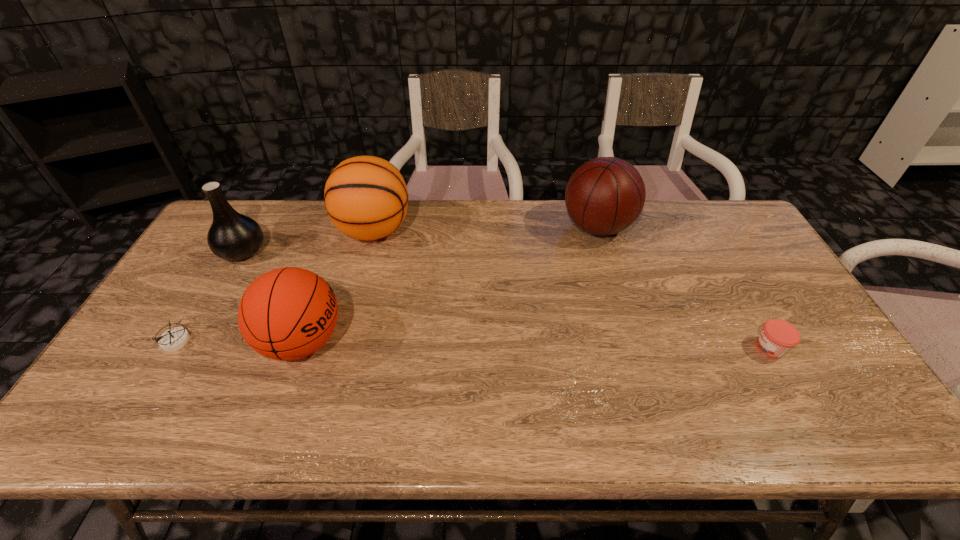
The width and height of the screenshot is (960, 540). Find the location of `vacant space at the left edge of the desktop`. vacant space at the left edge of the desktop is located at coordinates (204, 255).

Where is `free space at the right edge`? The image size is (960, 540). free space at the right edge is located at coordinates (832, 366).

The height and width of the screenshot is (540, 960). Find the location of `vacant space at the near right corner of the desktop`. vacant space at the near right corner of the desktop is located at coordinates (799, 408).

At what (x,y) coordinates should I click in order to perform the action: click on free space between the nearest basketball and the second shortest object. Please return your answer as a coordinate pair (x, y). Image resolution: width=960 pixels, height=540 pixels. Looking at the image, I should click on (537, 345).

Find the location of a particular element. The height and width of the screenshot is (540, 960). free space between the jam and the vase is located at coordinates (506, 299).

Image resolution: width=960 pixels, height=540 pixels. I want to click on vacant point located between the second shortest object and the shortest object, so click(473, 344).

At what (x,y) coordinates should I click in order to perform the action: click on free point between the vase and the jam. Please return your answer as a coordinate pair (x, y). Image resolution: width=960 pixels, height=540 pixels. Looking at the image, I should click on (506, 299).

Locate an element on the screen. The width and height of the screenshot is (960, 540). free space between the compass and the rightmost object is located at coordinates (473, 344).

Where is `free space that is in between the nearest basketball and the compass`? The height and width of the screenshot is (540, 960). free space that is in between the nearest basketball and the compass is located at coordinates (239, 341).

Locate which object is the fifth closest to the fifth object from left to right. Please provide its 2D coordinates. Your answer should be formatted as a tuple, i.e. [(x, y)], where the tuple contains the x and y coordinates of a point satisfying the conditions above.

[(173, 339)]